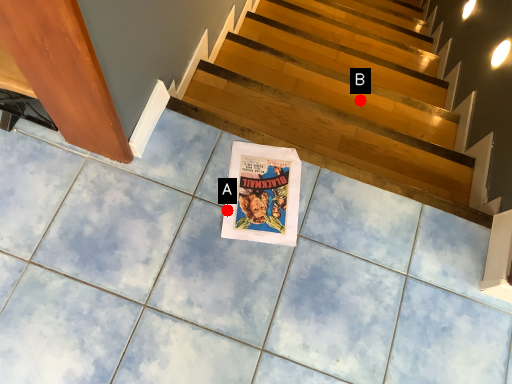
Question: Two points are circled on the image, labeled by A and B beside each circle. Which point is closer to the camera taking this photo?

Choices:
 (A) A is closer
 (B) B is closer

Answer: (A)